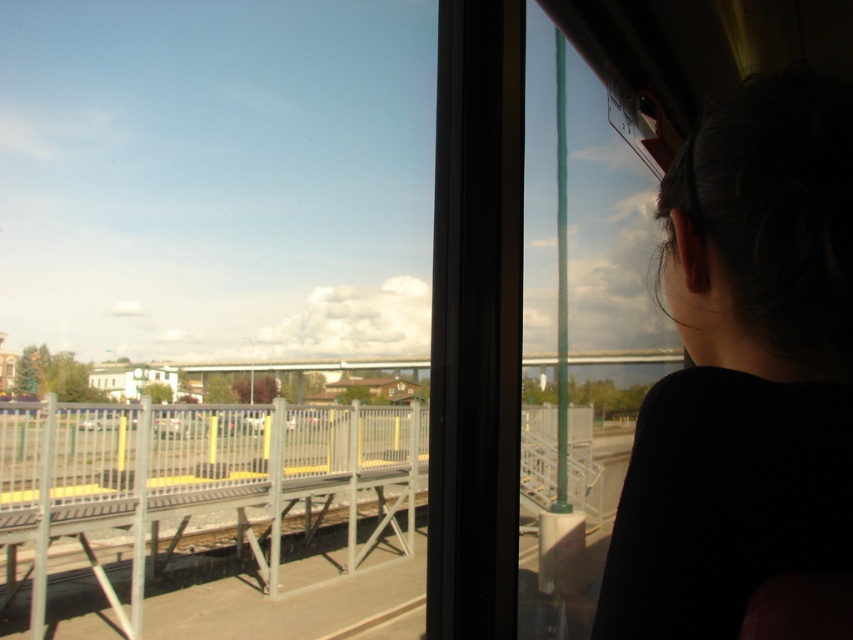
Based on the provided scene, where is the dark hair at upper right located in terms of coordinates?

The dark hair at upper right is located at coordinates point (x=744, y=369).